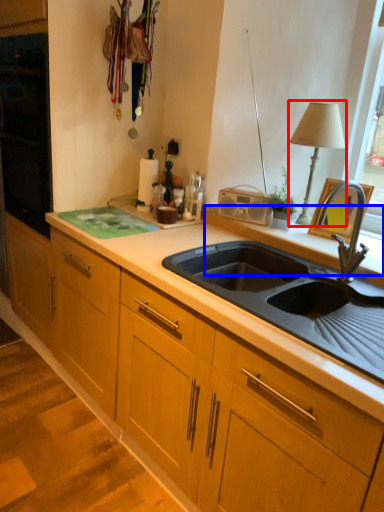
Question: Among these objects, which one is nearest to the camera, table lamp (highlighted by a red box) or window sill (highlighted by a blue box)?

Choices:
 (A) table lamp
 (B) window sill

Answer: (B)